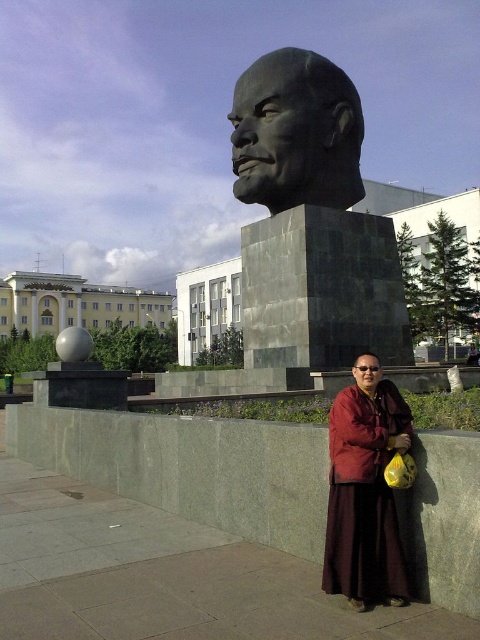
Is gray stone bust at center below bronze statue at center?

No.

Can you confirm if gray stone bust at center is bigger than bronze statue at center?

Yes.

Who is more distant from viewer, (345, 84) or (363, 385)?

The point (345, 84) is more distant.

You are a GUI agent. You are given a task and a screenshot of the screen. Output one action in this format:
    pyautogui.click(x=<x>, y=<y>)
    Task: Click on the gray stone bust at center
    This screenshot has width=480, height=640.
    Given the screenshot: What is the action you would take?
    pyautogui.click(x=296, y=132)

Who is lower down, gray stone bust at center or burgundy woolen robe at lower center?

burgundy woolen robe at lower center is below.

Is gray stone bust at center above burgundy woolen robe at lower center?

Yes.

The height and width of the screenshot is (640, 480). Find the location of `gray stone bust at center`. gray stone bust at center is located at coordinates (296, 132).

Consider the image. Does dark gray stone bust at center have a greater width compared to bronze statue at center?

Yes, dark gray stone bust at center is wider than bronze statue at center.

Which is in front, point (252, 352) or point (370, 358)?

Point (370, 358)

Which is in front, point (344, 205) or point (358, 381)?

Point (358, 381) is more forward.

You are a GUI agent. You are given a task and a screenshot of the screen. Output one action in this format:
    pyautogui.click(x=<x>, y=<y>)
    Task: Click on the dark gray stone bust at center
    
    Given the screenshot: What is the action you would take?
    pyautogui.click(x=311, y=220)